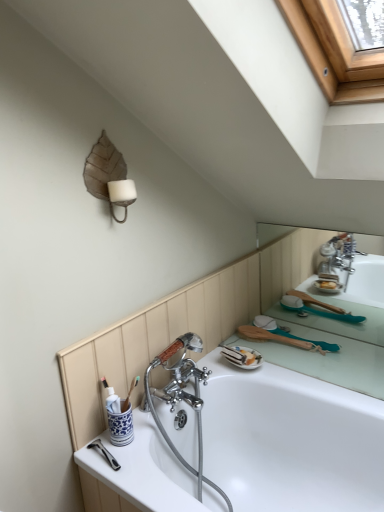
Question: Choose the correct answer: Is burlap leaf at upper left inside white glossy bathtub at center or outside it?

Choices:
 (A) outside
 (B) inside

Answer: (A)

Question: Is burlap leaf at upper left wider or thinner than white glossy bathtub at center?

Choices:
 (A) thin
 (B) wide

Answer: (A)

Question: Considering their positions, is burlap leaf at upper left located in front of or behind white glossy bathtub at center?

Choices:
 (A) front
 (B) behind

Answer: (B)

Question: Based on their positions, is white glossy bathtub at center located to the left or right of burlap leaf at upper left?

Choices:
 (A) left
 (B) right

Answer: (B)

Question: Looking at the image, does white glossy bathtub at center seem bigger or smaller compared to burlap leaf at upper left?

Choices:
 (A) big
 (B) small

Answer: (A)

Question: From the image's perspective, is white glossy bathtub at center positioned above or below burlap leaf at upper left?

Choices:
 (A) above
 (B) below

Answer: (B)

Question: From a real-world perspective, is white glossy bathtub at center above or below burlap leaf at upper left?

Choices:
 (A) below
 (B) above

Answer: (A)